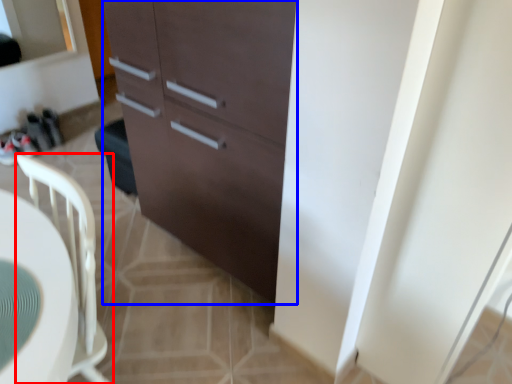
Question: Which of the following is the farthest to the observer, chair (highlighted by a red box) or cabinetry (highlighted by a blue box)?

Choices:
 (A) chair
 (B) cabinetry

Answer: (B)